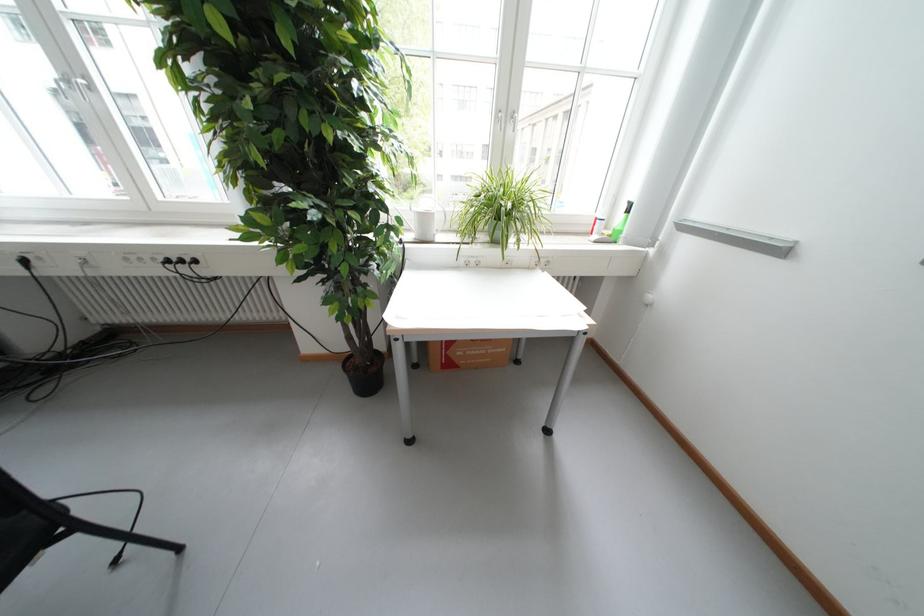
Locate an element on the screen. Image resolution: width=924 pixels, height=616 pixels. silver window handle is located at coordinates (499, 120).